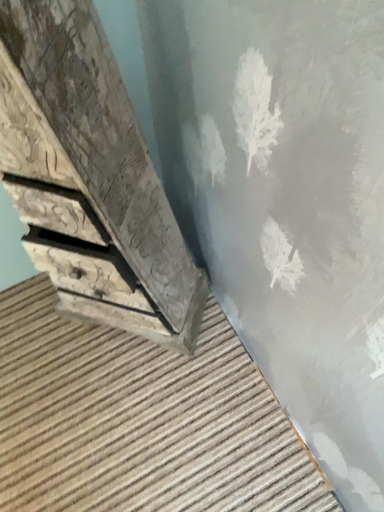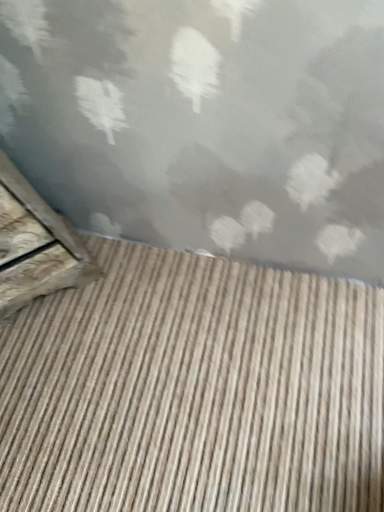
Question: How did the camera likely rotate when shooting the video?

Choices:
 (A) rotated left
 (B) rotated right

Answer: (B)